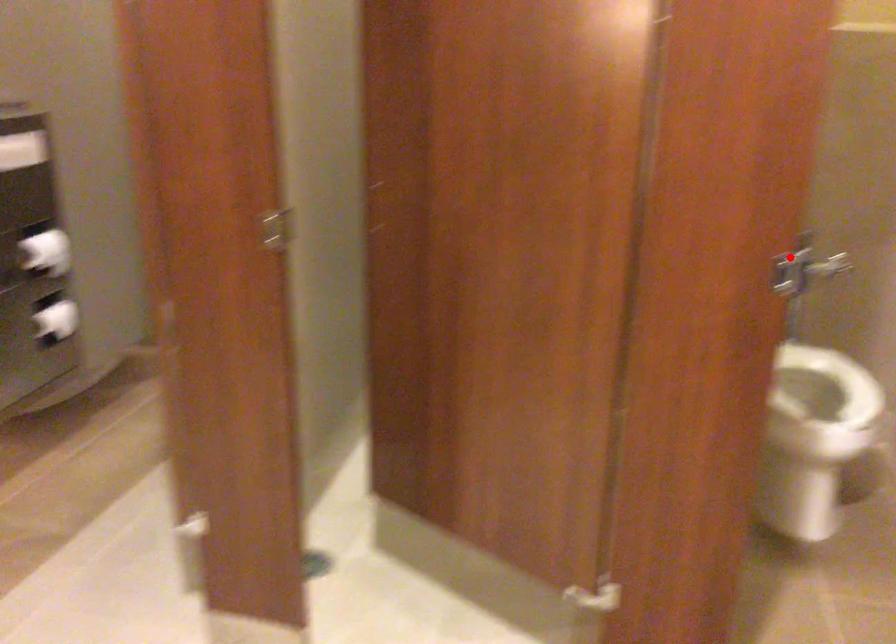
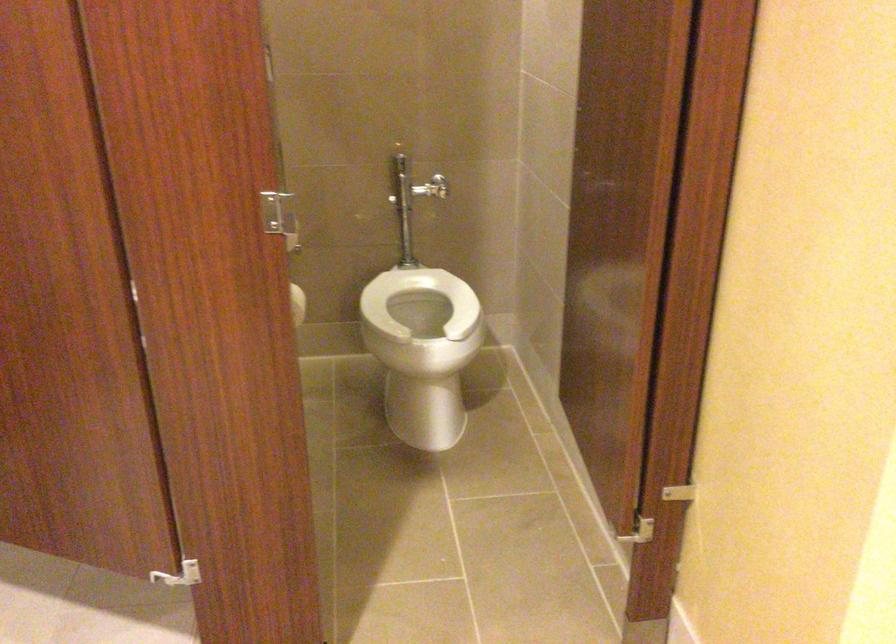
Where in the second image is the point corresponding to the highlighted location from the first image?

(279, 216)